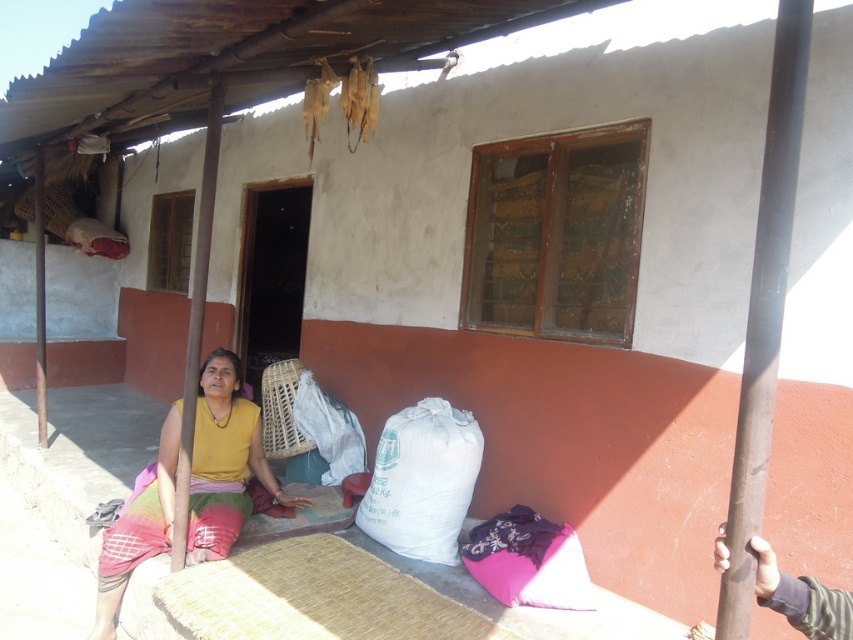
Question: Can you confirm if white fabric sack at lower center is wider than smooth wooden pole at left?

Choices:
 (A) no
 (B) yes

Answer: (B)

Question: Among these points, which one is nearest to the camera?

Choices:
 (A) (740, 572)
 (B) (262, 474)
 (C) (556, 600)
 (D) (178, 548)

Answer: (A)

Question: Which object is farther from the camera taking this photo?

Choices:
 (A) pink fabric pillow at lower right
 (B) smooth wooden pole at left

Answer: (B)

Question: Is white fabric sack at lower center further to camera compared to pink fabric pillow at lower right?

Choices:
 (A) yes
 (B) no

Answer: (A)

Question: Does white fabric sack at lower center appear on the right side of smooth wooden pole at left?

Choices:
 (A) yes
 (B) no

Answer: (A)

Question: Among these objects, which one is farthest from the camera?

Choices:
 (A) smooth wooden pole at left
 (B) white fabric sack at lower center
 (C) pink fabric pillow at lower right
 (D) dark brown wooden pole at right

Answer: (A)